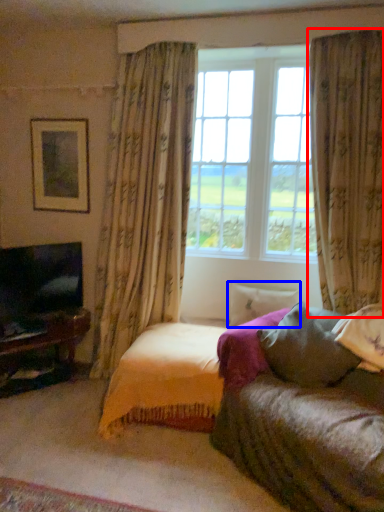
Question: Among these objects, which one is farthest to the camera, curtain (highlighted by a red box) or pillow (highlighted by a blue box)?

Choices:
 (A) curtain
 (B) pillow

Answer: (B)